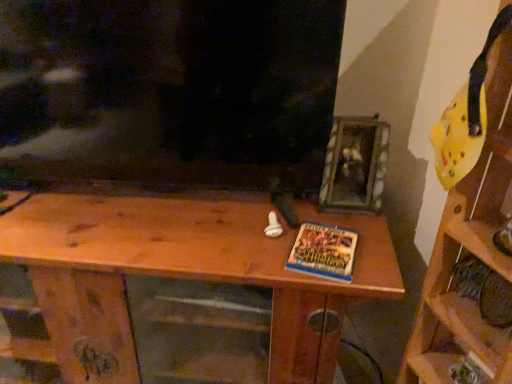
Question: Could you tell me if yellow foam helmet at upper right, placed as the second shelf when sorted from left to right, is turned towards wooden table at center, which is counted as the first shelf, starting from the left?

Choices:
 (A) yes
 (B) no

Answer: (B)

Question: Considering the relative positions of yellow foam helmet at upper right, placed as the second shelf when sorted from left to right, and wooden table at center, which is counted as the first shelf, starting from the left, in the image provided, is yellow foam helmet at upper right, placed as the second shelf when sorted from left to right, in front of wooden table at center, which is counted as the first shelf, starting from the left,?

Choices:
 (A) no
 (B) yes

Answer: (B)

Question: Is yellow foam helmet at upper right, which is the first shelf from right to left, not near wooden table at center, the 2th shelf positioned from the right?

Choices:
 (A) no
 (B) yes

Answer: (A)

Question: Is yellow foam helmet at upper right, which is the first shelf from right to left, touching wooden table at center, which is counted as the first shelf, starting from the left?

Choices:
 (A) yes
 (B) no

Answer: (B)

Question: Is yellow foam helmet at upper right, placed as the second shelf when sorted from left to right, at the right side of wooden table at center, which is counted as the first shelf, starting from the left?

Choices:
 (A) yes
 (B) no

Answer: (A)

Question: From the image's perspective, would you say yellow foam helmet at upper right, placed as the second shelf when sorted from left to right, is positioned over wooden table at center, which is counted as the first shelf, starting from the left?

Choices:
 (A) yes
 (B) no

Answer: (A)

Question: From the image's perspective, is blue glossy book at center beneath yellow foam helmet at upper right, placed as the second shelf when sorted from left to right?

Choices:
 (A) no
 (B) yes

Answer: (A)

Question: Can you confirm if blue glossy book at center is wider than yellow foam helmet at upper right, which is the first shelf from right to left?

Choices:
 (A) yes
 (B) no

Answer: (B)

Question: Is blue glossy book at center outside of yellow foam helmet at upper right, which is the first shelf from right to left?

Choices:
 (A) yes
 (B) no

Answer: (A)

Question: From a real-world perspective, is blue glossy book at center on top of yellow foam helmet at upper right, which is the first shelf from right to left?

Choices:
 (A) no
 (B) yes

Answer: (B)

Question: Is blue glossy book at center directly adjacent to yellow foam helmet at upper right, placed as the second shelf when sorted from left to right?

Choices:
 (A) yes
 (B) no

Answer: (B)

Question: From the image's perspective, would you say blue glossy book at center is positioned over yellow foam helmet at upper right, which is the first shelf from right to left?

Choices:
 (A) yes
 (B) no

Answer: (A)

Question: Does wooden table at center, which is counted as the first shelf, starting from the left, contain blue glossy book at center?

Choices:
 (A) no
 (B) yes

Answer: (A)